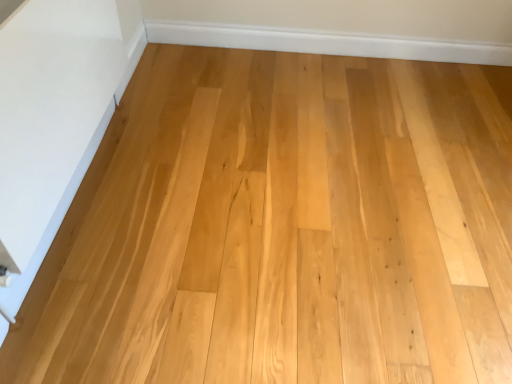
Where is `free space above natural wood floor at upper center (from a real-world perspective)`? This screenshot has width=512, height=384. free space above natural wood floor at upper center (from a real-world perspective) is located at coordinates (337, 32).